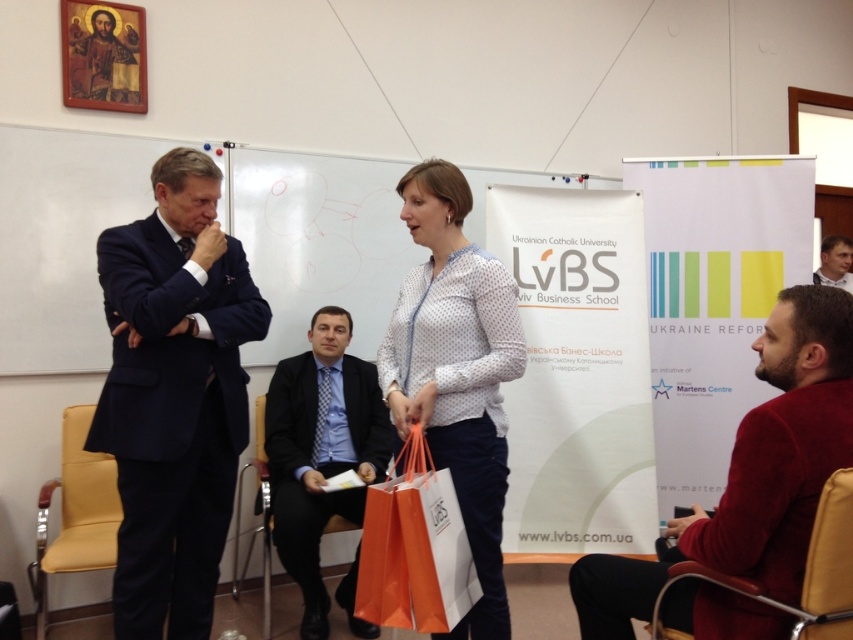
You are standing in the conference room and need to locate the navy blue suit at left. According to the scene description, where would you find it in relation to the woman with the orange shopping bags?

The navy blue suit at left is located at point 0.620 on the horizontal axis and 0.205 on the vertical axis relative to the woman with the orange shopping bags.

Consider the image. You are a conference attendee who needs to sit down. You see the navy blue suit at left and the yellow fabric chair at lower left. Which object is closer to you?

The navy blue suit at left is closer to the viewer than the yellow fabric chair at lower left.